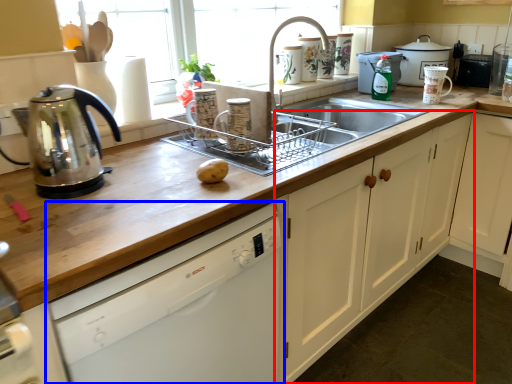
Question: Which of the following is the farthest to the observer, cabinetry (highlighted by a red box) or dishwasher (highlighted by a blue box)?

Choices:
 (A) cabinetry
 (B) dishwasher

Answer: (A)